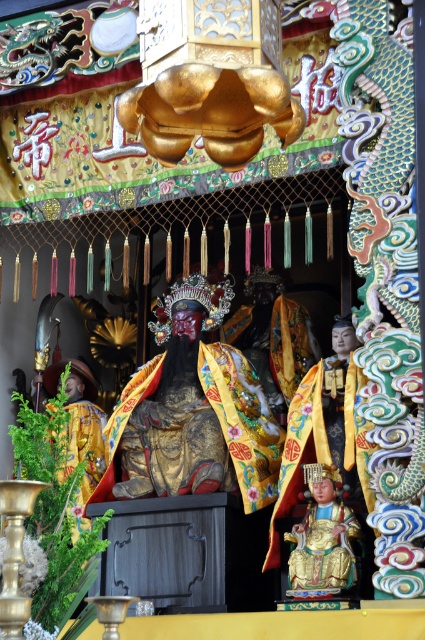
You are a photographer standing at the entrance of the temple and want to take a closeup shot of the gold brocade robe at center. Given that your camera has a maximum zoom range of 100 meters, can you capture the robe clearly without moving closer?

The gold brocade robe at center is 72.46 meters away from the camera. Since your camera can zoom up to 100 meters, you can capture the robe clearly without moving closer.

You are an art student analyzing the composition of the image. You observe the gold brocade robe at center and the gold lacquered statue at lower center. Which object is positioned higher in the image?

The gold brocade robe at center is positioned higher than the gold lacquered statue at lower center.

You are a visitor standing in front of the gold lacquered statue at lower center in the temple. You want to touch the gold brocade robe at center. Is the robe within your reach?

The gold brocade robe at center is 13.16 meters away from the gold lacquered statue at lower center. Since the distance is too large, the robe is not within your reach.